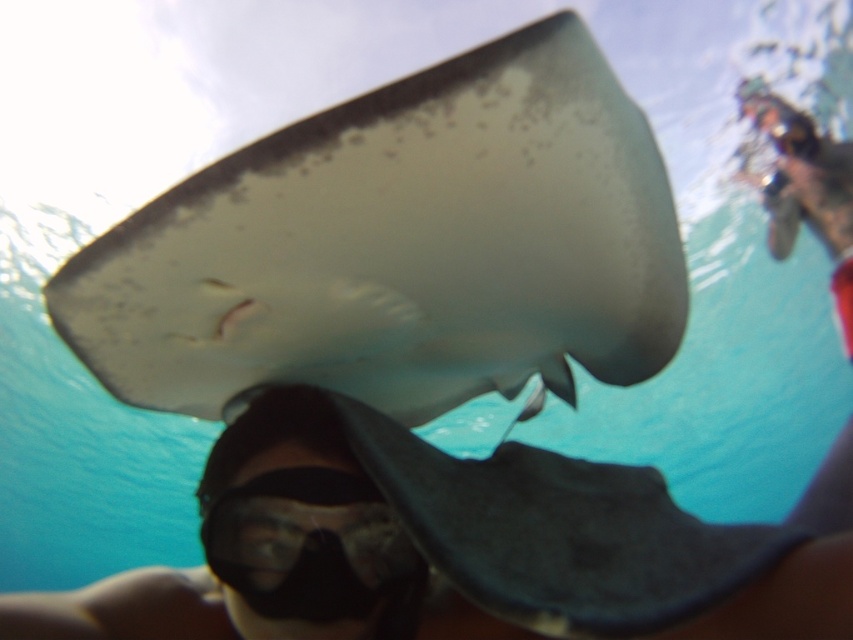
Which is above, smooth white stingray at center or black matte goggles at lower center?

smooth white stingray at center

Which is more to the right, smooth white stingray at center or black matte goggles at lower center?

Positioned to the right is smooth white stingray at center.

Which is in front, point (264, 202) or point (401, 602)?

Point (264, 202) is more forward.

Where is `smooth white stingray at center`? This screenshot has height=640, width=853. smooth white stingray at center is located at coordinates (399, 248).